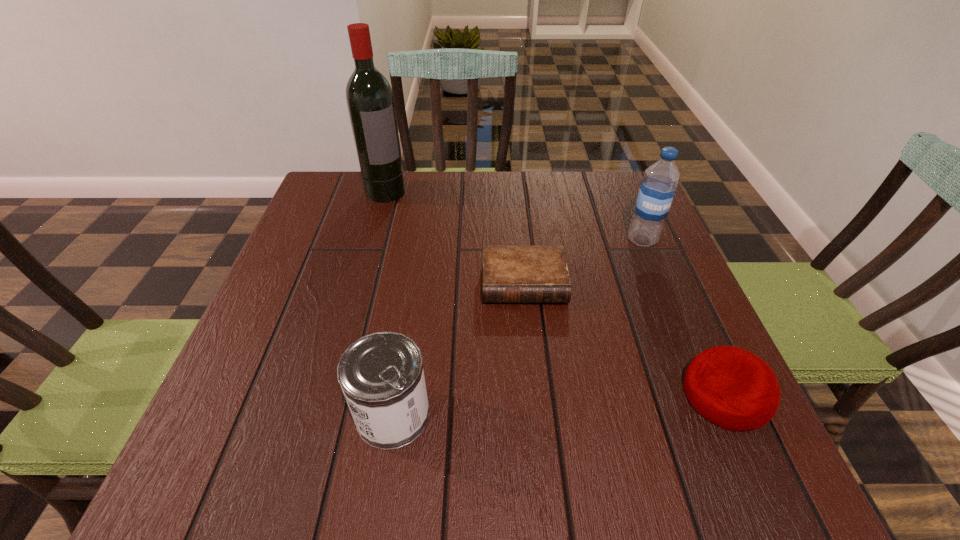
Locate an element on the screen. This screenshot has width=960, height=540. vacant space at the near edge of the desktop is located at coordinates (567, 386).

Where is `vacant area at the left edge of the desktop`? vacant area at the left edge of the desktop is located at coordinates (315, 305).

Find the location of `vacant space at the right edge`. vacant space at the right edge is located at coordinates (682, 318).

Image resolution: width=960 pixels, height=540 pixels. I want to click on free space at the far right corner of the desktop, so click(611, 193).

Find the location of `vacant space at the near right corner`. vacant space at the near right corner is located at coordinates (681, 393).

Image resolution: width=960 pixels, height=540 pixels. Find the location of `vacant region between the water bottle and the wine bottle`. vacant region between the water bottle and the wine bottle is located at coordinates (514, 216).

Find the location of `free space between the second shortest object and the fourth nearest object`. free space between the second shortest object and the fourth nearest object is located at coordinates (684, 318).

At what (x,y) coordinates should I click in order to perform the action: click on free space between the beanbag and the water bottle. Please return your answer as a coordinate pair (x, y). This screenshot has width=960, height=540. Looking at the image, I should click on tap(684, 318).

Find the location of a particular element. vacant space that is in between the water bottle and the farthest object is located at coordinates (514, 216).

Locate an element on the screen. free spot between the shortest object and the wine bottle is located at coordinates (455, 237).